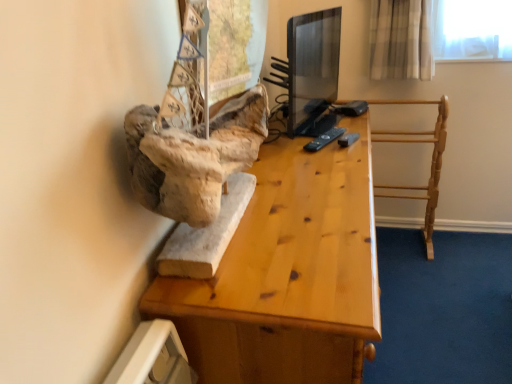
The image size is (512, 384). Identify the location of blank space to the left of black plastic remote at center. (286, 141).